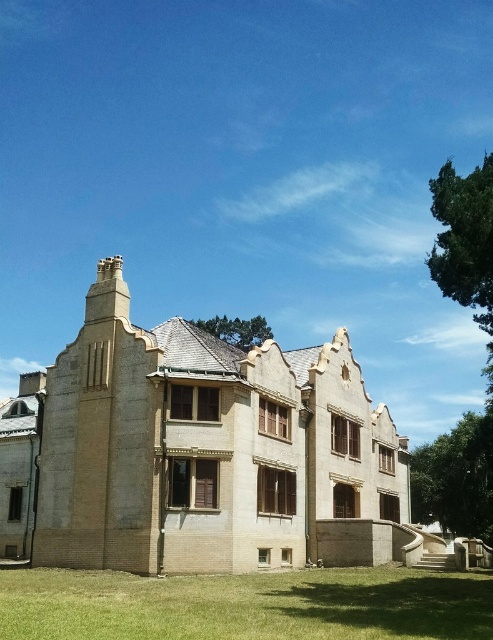
Measure the distance from beige brick mansion at center to green grass at lower center.

The distance of beige brick mansion at center from green grass at lower center is 12.21 meters.

Between beige brick mansion at center and green grass at lower center, which one appears on the left side from the viewer's perspective?

From the viewer's perspective, beige brick mansion at center appears more on the left side.

Is point (91, 380) positioned before point (153, 584)?

No, (91, 380) is further to viewer.

I want to click on beige brick mansion at center, so click(x=195, y=449).